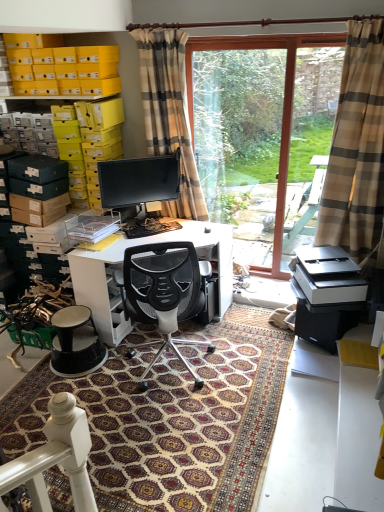
Question: From a real-world perspective, is patterned carpet at center under white glossy desk at center?

Choices:
 (A) yes
 (B) no

Answer: (A)

Question: Is patterned carpet at center at the left side of white glossy desk at center?

Choices:
 (A) no
 (B) yes

Answer: (A)

Question: From the image's perspective, is patterned carpet at center beneath white glossy desk at center?

Choices:
 (A) yes
 (B) no

Answer: (A)

Question: Considering the relative sizes of patterned carpet at center and white glossy desk at center in the image provided, is patterned carpet at center thinner than white glossy desk at center?

Choices:
 (A) yes
 (B) no

Answer: (B)

Question: Is patterned carpet at center beside white glossy desk at center?

Choices:
 (A) yes
 (B) no

Answer: (B)

Question: From a real-world perspective, relative to beige plaid curtain at right, the first curtain when ordered from right to left, is transparent glass door at center vertically above or below?

Choices:
 (A) above
 (B) below

Answer: (A)

Question: From the image's perspective, is transparent glass door at center located above or below beige plaid curtain at right, marked as the 2th curtain in a left-to-right arrangement?

Choices:
 (A) above
 (B) below

Answer: (A)

Question: Is transparent glass door at center situated inside beige plaid curtain at right, the first curtain when ordered from right to left, or outside?

Choices:
 (A) outside
 (B) inside

Answer: (A)

Question: Does point (278, 272) appear closer or farther from the camera than point (350, 162)?

Choices:
 (A) farther
 (B) closer

Answer: (A)

Question: Considering the relative positions of black mesh office chair at center and matte black monitor at center in the image provided, is black mesh office chair at center to the left or to the right of matte black monitor at center?

Choices:
 (A) right
 (B) left

Answer: (A)

Question: From a real-world perspective, is black mesh office chair at center physically located above or below matte black monitor at center?

Choices:
 (A) above
 (B) below

Answer: (B)

Question: Relative to matte black monitor at center, is black mesh office chair at center in front or behind?

Choices:
 (A) behind
 (B) front

Answer: (B)

Question: Considering the positions of black mesh office chair at center and matte black monitor at center in the image, is black mesh office chair at center bigger or smaller than matte black monitor at center?

Choices:
 (A) small
 (B) big

Answer: (B)

Question: From a real-world perspective, is white matte printer at lower right positioned above or below matte black monitor at center?

Choices:
 (A) above
 (B) below

Answer: (B)

Question: Considering the positions of white matte printer at lower right and matte black monitor at center in the image, is white matte printer at lower right wider or thinner than matte black monitor at center?

Choices:
 (A) thin
 (B) wide

Answer: (B)